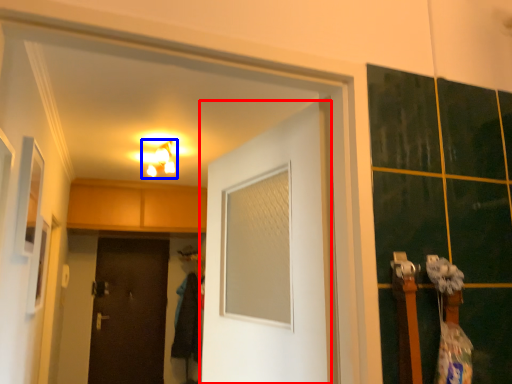
Question: Which object appears closest to the camera in this image, door (highlighted by a red box) or light fixture (highlighted by a blue box)?

Choices:
 (A) door
 (B) light fixture

Answer: (A)